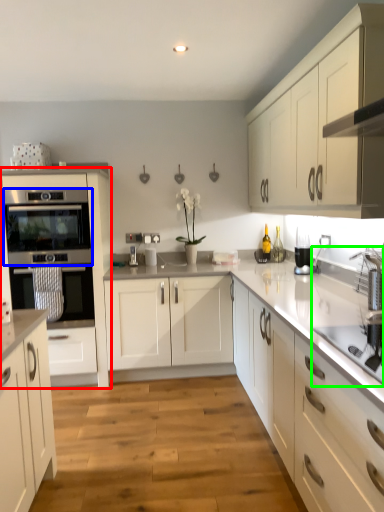
Question: Estimate the real-world distances between objects in this image. Which object is farther from cabinetry (highlighted by a red box), oven (highlighted by a blue box) or sink (highlighted by a green box)?

Choices:
 (A) oven
 (B) sink

Answer: (B)